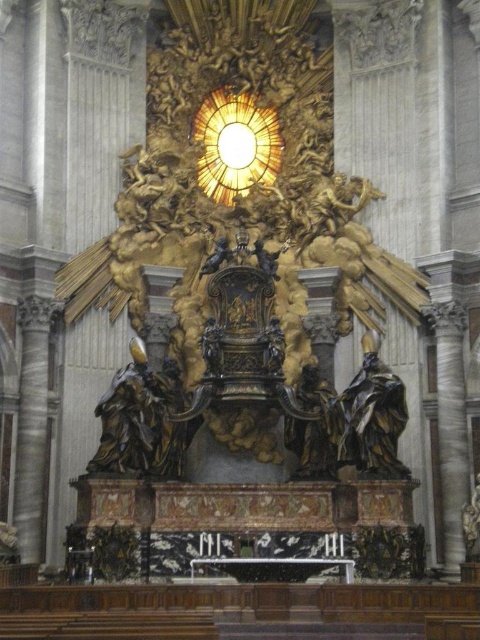
You are standing in the cathedral and want to check the time on the golden textured clock at upper center. Considering your height is 1.7 meters, can you reach the clock to adjust it?

The golden textured clock at upper center is 96.13 meters away from the viewer, which is far too distant to reach even for someone of 1.7 meters in height. You would need a specialized ladder or equipment to access it.

You are an art conservator examining the altar. You need to clean both the golden textured clock at upper center and the bronze statue at right. Which object should you start with if you want to work on the closest one first?

You should start with the golden textured clock at upper center because it is closer to you than the bronze statue at right.